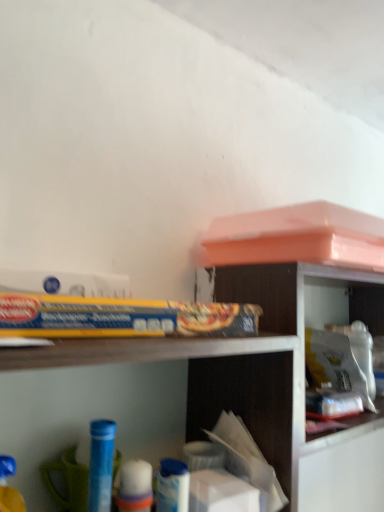
Question: Is point (302, 493) positioned closer to the camera than point (18, 508)?

Choices:
 (A) farther
 (B) closer

Answer: (A)

Question: Relative to blue plastic toy at lower left, positioned as the 2th toy in back-to-front order, is wooden bookshelf at upper right in front or behind?

Choices:
 (A) front
 (B) behind

Answer: (B)

Question: Which of these objects is positioned closest to the blue plastic toy at lower left, which is the 1th toy in left-to-right order?

Choices:
 (A) wooden bookshelf at upper right
 (B) white plastic container at upper right
 (C) wooden shelf at upper center
 (D) blue plastic tube at lower left, which ranks as the 1th toy in back-to-front order

Answer: (D)

Question: Which object is the closest to the wooden shelf at upper center?

Choices:
 (A) white plastic container at upper right
 (B) blue plastic toy at lower left, the second toy positioned from the right
 (C) blue plastic tube at lower left, which is counted as the 1th toy, starting from the right
 (D) wooden bookshelf at upper right

Answer: (D)